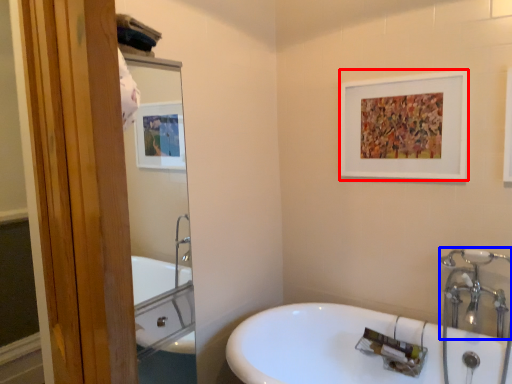
Question: Which object is closer to the camera taking this photo, picture frame (highlighted by a red box) or plumbing fixture (highlighted by a blue box)?

Choices:
 (A) picture frame
 (B) plumbing fixture

Answer: (B)